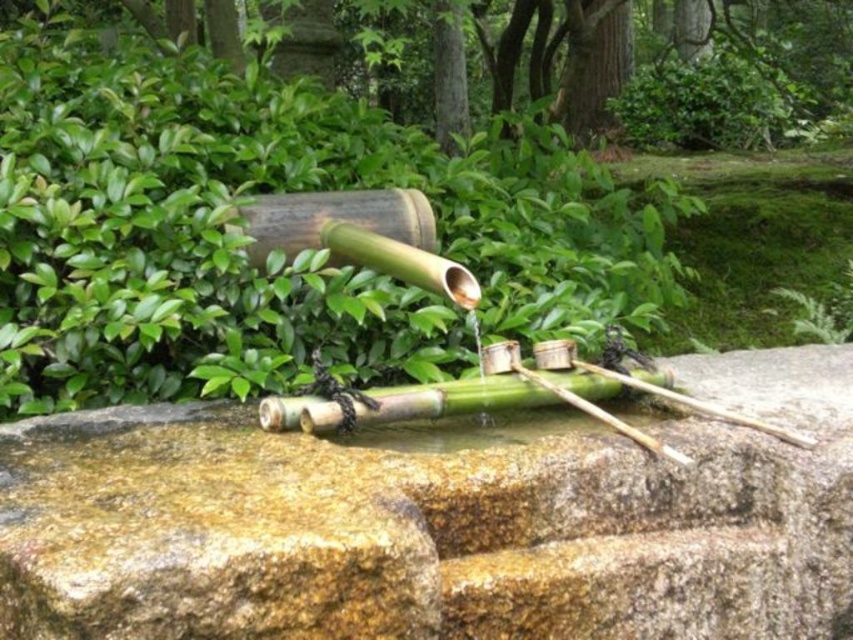
Is green stone basin at center further to the viewer compared to green leafy bush at upper left?

No.

Which is in front, point (19, 458) or point (115, 144)?

Positioned in front is point (19, 458).

Where is `green stone basin at center`? green stone basin at center is located at coordinates [x=439, y=522].